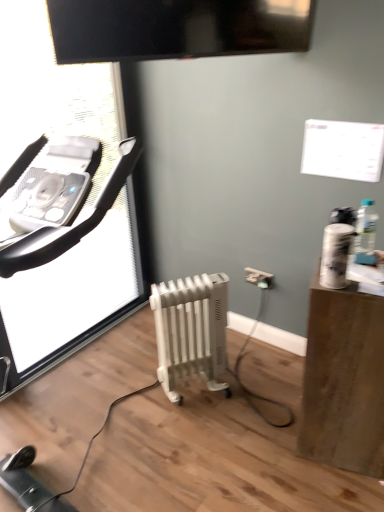
Where is `free space in front of brown wood side table at right`? free space in front of brown wood side table at right is located at coordinates (336, 489).